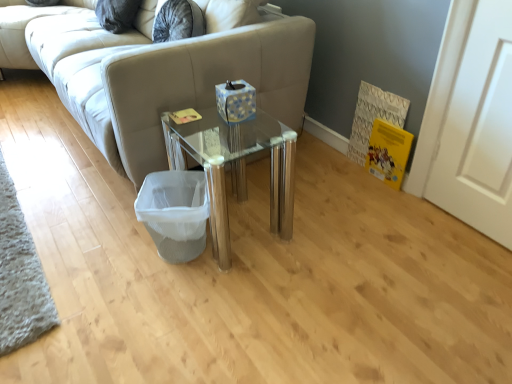
Question: Considering the positions of point (139, 211) and point (265, 130), is point (139, 211) closer or farther from the camera than point (265, 130)?

Choices:
 (A) farther
 (B) closer

Answer: (B)

Question: From the image's perspective, is white mesh laundry basket at lower center located above or below transparent glass table at center?

Choices:
 (A) above
 (B) below

Answer: (B)

Question: Which of these objects is positioned closest to the transparent glass table at center?

Choices:
 (A) beige fabric studio couch at center
 (B) white mesh laundry basket at lower center

Answer: (B)

Question: Which of these objects is positioned closest to the white mesh laundry basket at lower center?

Choices:
 (A) beige fabric studio couch at center
 (B) transparent glass table at center

Answer: (B)